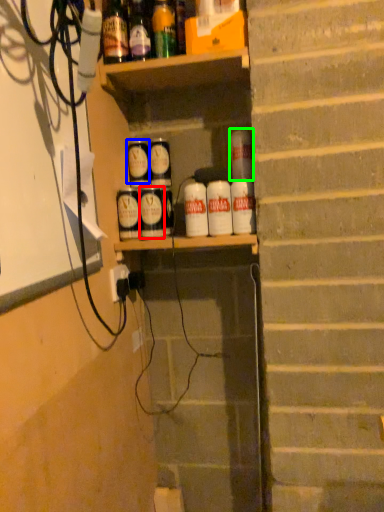
Question: Which is farther away from spray (highlighted by a red box)? spray (highlighted by a blue box) or beverage (highlighted by a green box)?

Choices:
 (A) spray
 (B) beverage

Answer: (B)